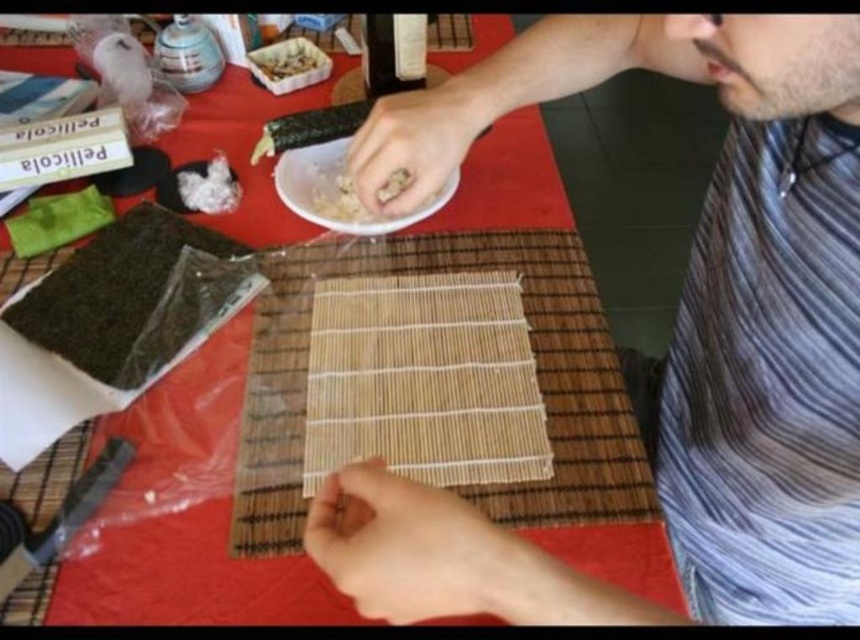
Question: Where is bamboo mat at center located in relation to shiny plastic container at upper center in the image?

Choices:
 (A) right
 (B) left

Answer: (A)

Question: In this image, where is white matte plate at center located relative to shiny plastic container at upper center?

Choices:
 (A) right
 (B) left

Answer: (A)

Question: Which point is closer to the camera?

Choices:
 (A) (293, 404)
 (B) (747, 60)

Answer: (B)

Question: Estimate the real-world distances between objects in this image. Which object is farther from the white matte plate at center?

Choices:
 (A) shiny plastic container at upper center
 (B) striped cotton shirt at center

Answer: (B)

Question: Which object is the closest to the striped cotton shirt at center?

Choices:
 (A) shiny plastic container at upper center
 (B) white matte plate at center
 (C) bamboo mat at center

Answer: (C)

Question: Is bamboo mat at center thinner than white matte plate at center?

Choices:
 (A) no
 (B) yes

Answer: (A)